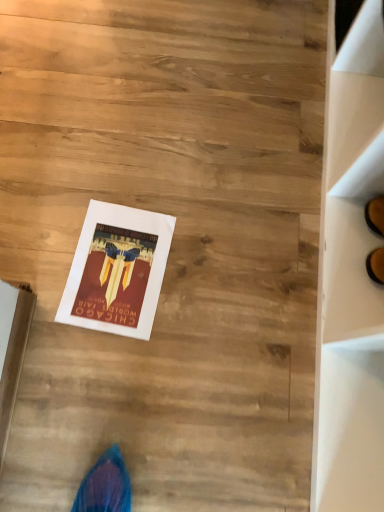
Identify the location of empty space that is ontop of matte paper poster at center (from a real-world perspective). This screenshot has height=512, width=384. (111, 267).